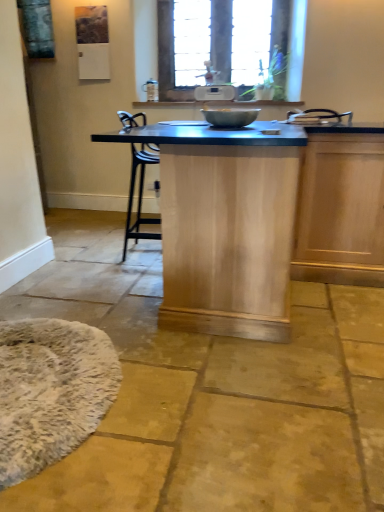
Where is `space that is in front of natural wood table at center`? This screenshot has width=384, height=512. space that is in front of natural wood table at center is located at coordinates (223, 404).